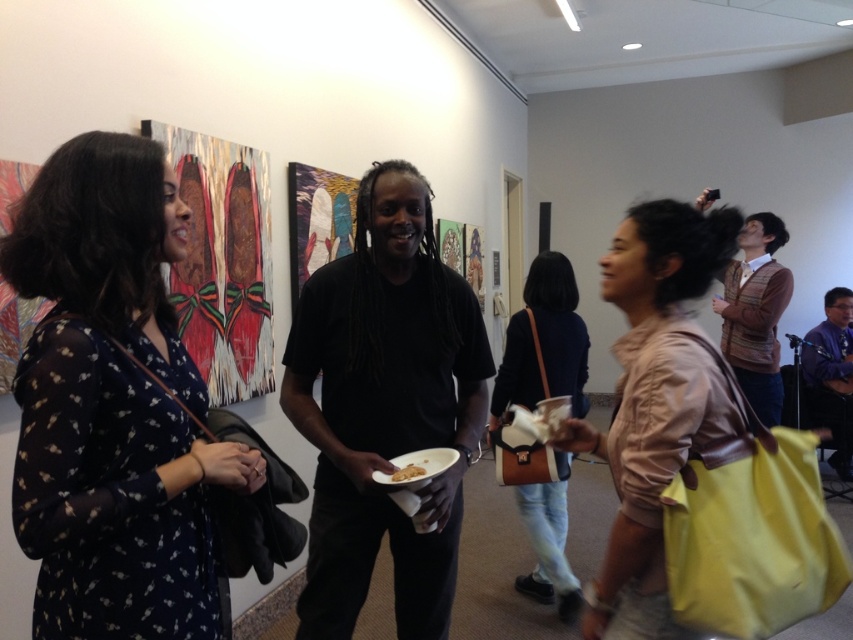
You are an event planner who needs to arrange a path for a food cart that is 4 feet wide. The cart must pass between the dark blue floral dress at left and the leather brown bag at center. Can the cart fit through the space between them?

The distance between the dark blue floral dress at left and the leather brown bag at center is 6.05 feet. Since the cart is 4 feet wide, it can fit through the space between them as there is enough clearance.

You are an event organizer who needs to adjust the seating arrangement for a presentation. You see the black matte shirt at center and the beige fabric bag at center. Which object is closer to the front of the room?

The black matte shirt at center is closer to the front of the room because the beige fabric bag at center is behind it.